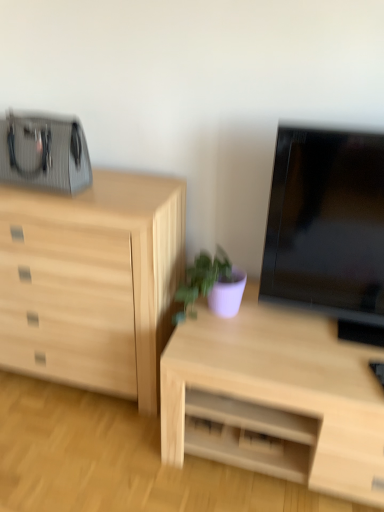
This screenshot has height=512, width=384. Identify the location of vacant area located to the right-hand side of purple matte plant at center. (272, 323).